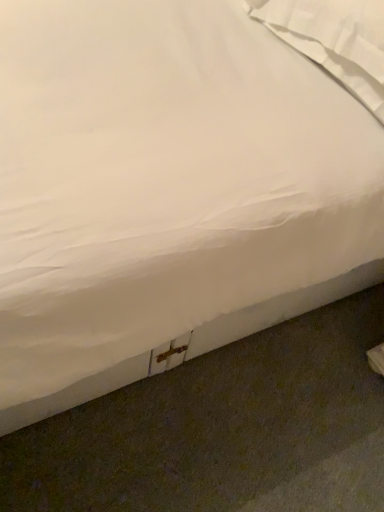
Where is `white soft pillow at upper right`? white soft pillow at upper right is located at coordinates (334, 39).

What is the approximate width of white soft pillow at upper right?

The width of white soft pillow at upper right is 19.16 inches.

Measure the distance between point (324, 16) and camera.

3.68 feet.

Describe the element at coordinates (334, 39) in the screenshot. I see `white soft pillow at upper right` at that location.

The width and height of the screenshot is (384, 512). I want to click on white soft pillow at upper right, so click(334, 39).